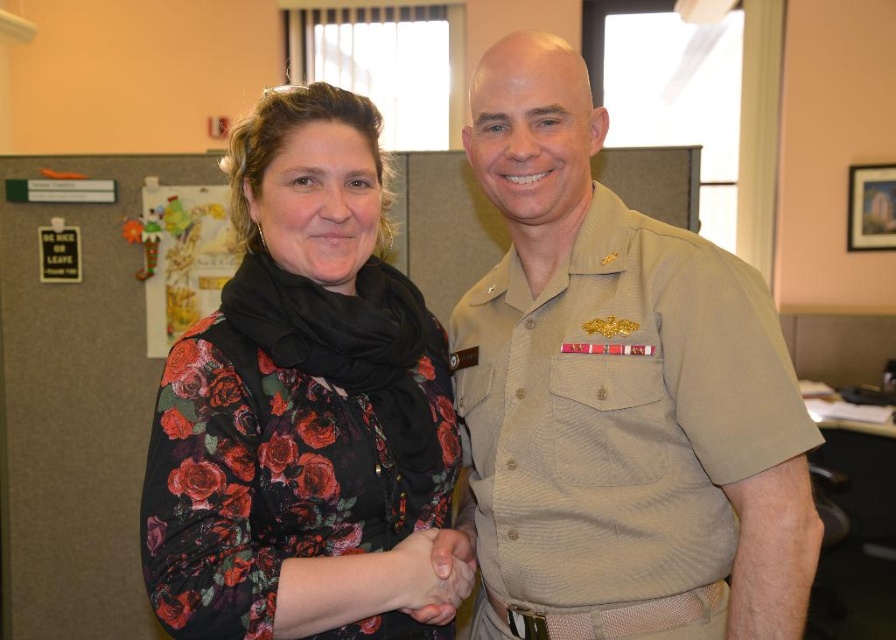
Is tan uniform shirt at center further to the viewer compared to floral print blouse at center?

That is True.

The image size is (896, 640). What do you see at coordinates (618, 396) in the screenshot?
I see `tan uniform shirt at center` at bounding box center [618, 396].

Which is in front, point (571, 600) or point (248, 419)?

Point (248, 419)

You are a GUI agent. You are given a task and a screenshot of the screen. Output one action in this format:
    pyautogui.click(x=<x>, y=<y>)
    Task: Click on the tan uniform shirt at center
    
    Given the screenshot: What is the action you would take?
    pyautogui.click(x=618, y=396)

Can you confirm if floral print blouse at center is positioned to the right of smooth skin hand at center?

In fact, floral print blouse at center is to the left of smooth skin hand at center.

Does point (209, 321) come behind point (457, 605)?

No, it is in front of (457, 605).

The width and height of the screenshot is (896, 640). Describe the element at coordinates (302, 404) in the screenshot. I see `floral print blouse at center` at that location.

I want to click on floral print blouse at center, so click(302, 404).

Is point (702, 385) positioned after point (455, 588)?

No, (702, 385) is in front of (455, 588).

Who is more distant from viewer, [477,529] or [451,593]?

Point [477,529]

Where is `tan uniform shirt at center`? This screenshot has height=640, width=896. tan uniform shirt at center is located at coordinates (618, 396).